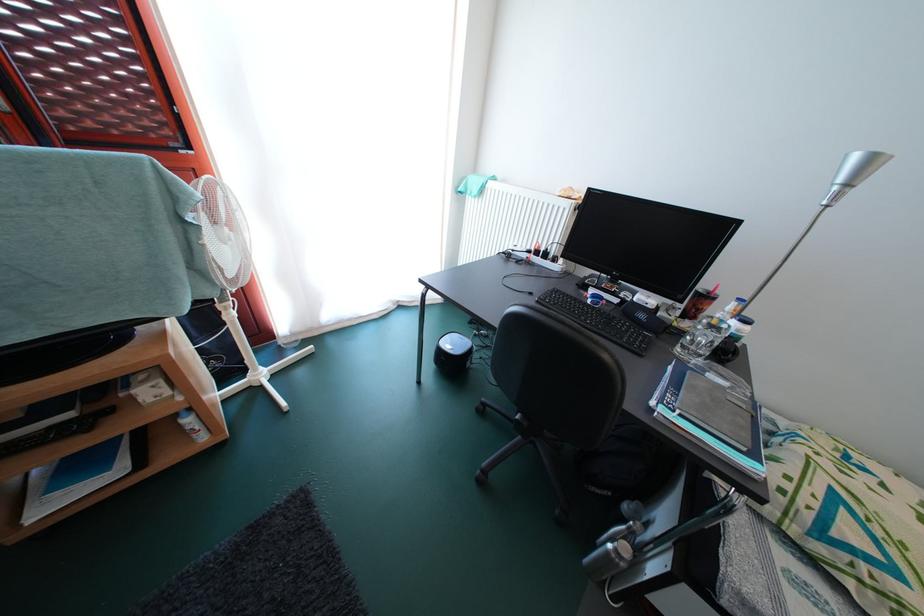
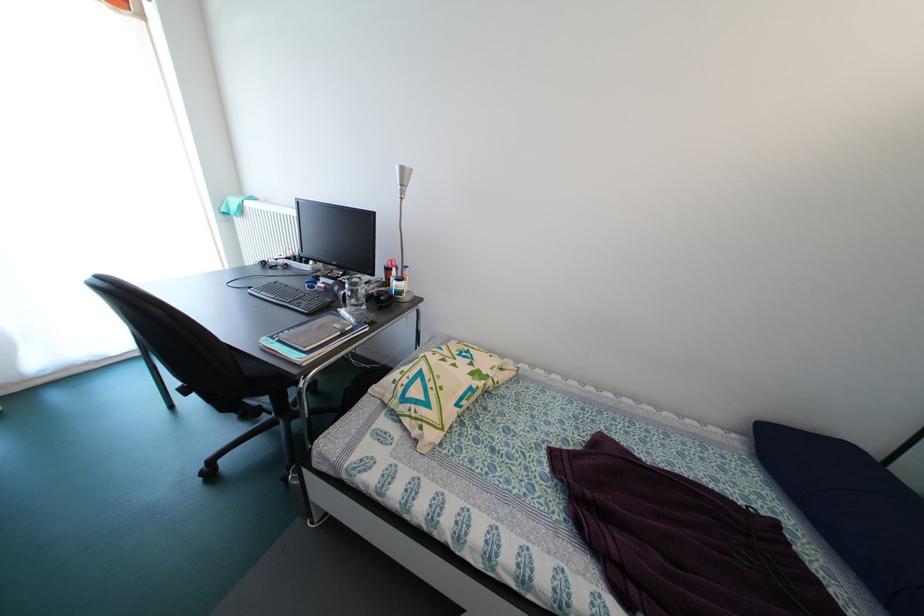
The point at [650,321] is marked in the first image. Where is the corresponding point in the second image?

(344, 294)